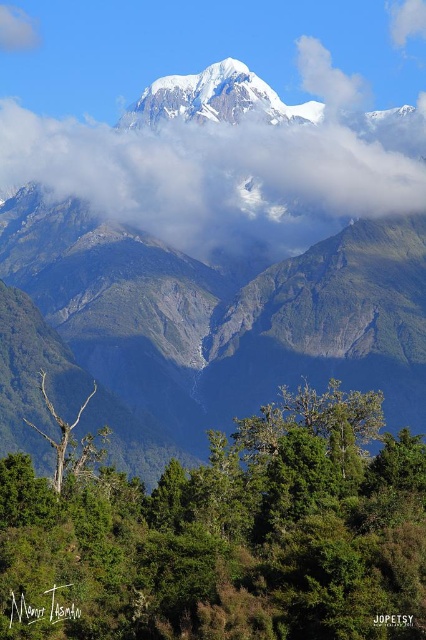
Where is `green leafy tree at lower center`? This screenshot has height=640, width=426. green leafy tree at lower center is located at coordinates (226, 534).

Locate an element on the screen. The width and height of the screenshot is (426, 640). green leafy tree at lower center is located at coordinates (226, 534).

Is snowy granite mountain range at upper center positioned in front of white fluffy cloud at upper center?

Yes, snowy granite mountain range at upper center is in front of white fluffy cloud at upper center.

Between snowy granite mountain range at upper center and white fluffy cloud at upper center, which one is positioned lower?

snowy granite mountain range at upper center is lower down.

Measure the distance between point (175, 326) and camera.

The distance of point (175, 326) from camera is 643.99 meters.

I want to click on snowy granite mountain range at upper center, so click(x=196, y=328).

Who is lower down, white fluffy cloud at upper center or bare wood tree at lower left?

Positioned lower is bare wood tree at lower left.

Is white fluffy cloud at upper center wider than bare wood tree at lower left?

Yes, white fluffy cloud at upper center is wider than bare wood tree at lower left.

Where is `white fluffy cloud at upper center`? Image resolution: width=426 pixels, height=640 pixels. white fluffy cloud at upper center is located at coordinates (213, 168).

The height and width of the screenshot is (640, 426). Find the location of `white fluffy cloud at upper center`. white fluffy cloud at upper center is located at coordinates (213, 168).